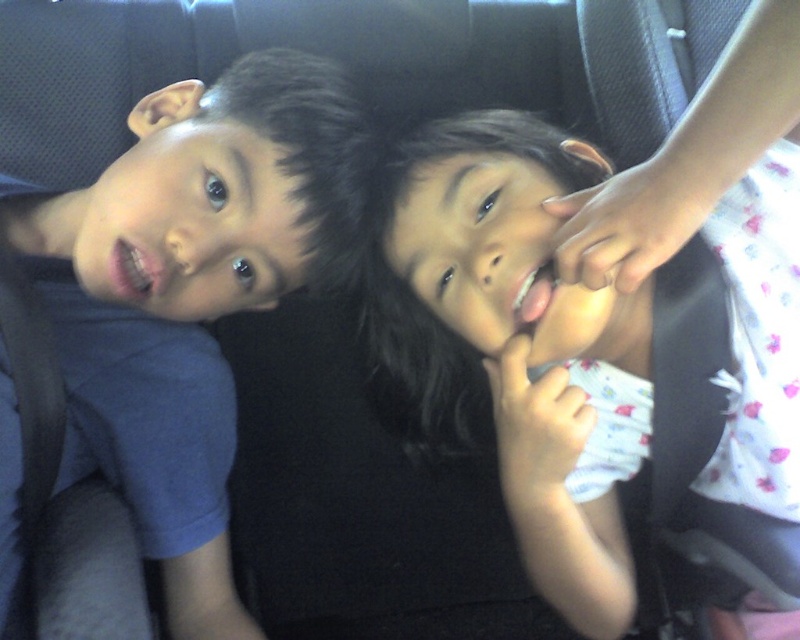
Is white floral dress at center positioned before white fabric hand at upper right?

No, white floral dress at center is behind white fabric hand at upper right.

Consider the image. Does white floral dress at center have a lesser height compared to white fabric hand at upper right?

No.

Where is `white floral dress at center`? This screenshot has height=640, width=800. white floral dress at center is located at coordinates (594, 356).

Who is positioned more to the right, white floral dress at center or blue matte shirt at left?

white floral dress at center

Can you confirm if white floral dress at center is positioned above blue matte shirt at left?

Incorrect, white floral dress at center is not positioned above blue matte shirt at left.

Is point (736, 433) more distant than point (270, 301)?

No, it is not.

Identify the location of white floral dress at center. (594, 356).

What do you see at coordinates (192, 291) in the screenshot?
I see `blue matte shirt at left` at bounding box center [192, 291].

Can you confirm if blue matte shirt at left is bigger than white fabric hand at upper right?

Indeed, blue matte shirt at left has a larger size compared to white fabric hand at upper right.

What do you see at coordinates (192, 291) in the screenshot?
I see `blue matte shirt at left` at bounding box center [192, 291].

At what (x,y) coordinates should I click in order to perform the action: click on blue matte shirt at left. Please return your answer as a coordinate pair (x, y). The height and width of the screenshot is (640, 800). Looking at the image, I should click on pyautogui.click(x=192, y=291).